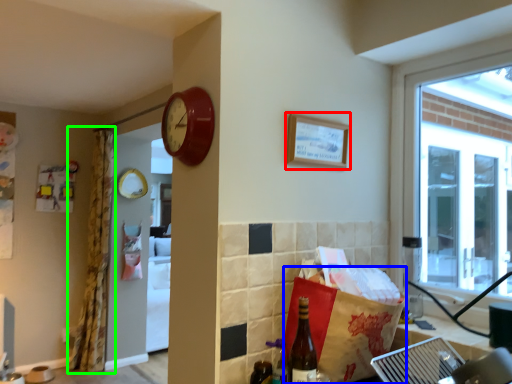
Question: Considering the real-world distances, which object is closest to picture frame (highlighted by a red box)? shopping bag (highlighted by a blue box) or curtain (highlighted by a green box).

Choices:
 (A) shopping bag
 (B) curtain

Answer: (A)